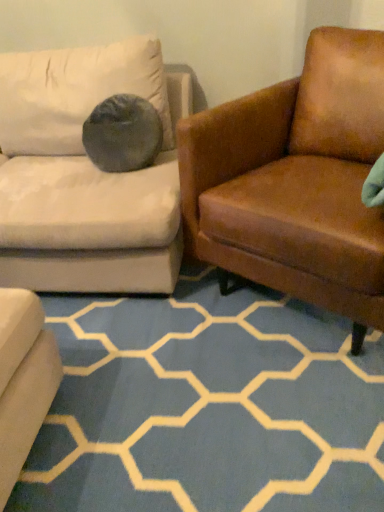
Question: Considering the relative sizes of blue carpet at center and brown leather armchair at right in the image provided, is blue carpet at center wider than brown leather armchair at right?

Choices:
 (A) no
 (B) yes

Answer: (A)

Question: From a real-world perspective, does blue carpet at center sit lower than brown leather armchair at right?

Choices:
 (A) yes
 (B) no

Answer: (A)

Question: Considering the relative sizes of blue carpet at center and brown leather armchair at right in the image provided, is blue carpet at center shorter than brown leather armchair at right?

Choices:
 (A) yes
 (B) no

Answer: (A)

Question: Is there a large distance between blue carpet at center and brown leather armchair at right?

Choices:
 (A) yes
 (B) no

Answer: (B)

Question: Does blue carpet at center turn towards brown leather armchair at right?

Choices:
 (A) no
 (B) yes

Answer: (A)

Question: Can you confirm if blue carpet at center is taller than brown leather armchair at right?

Choices:
 (A) no
 (B) yes

Answer: (A)

Question: Does brown leather armchair at right have a lesser height compared to blue carpet at center?

Choices:
 (A) yes
 (B) no

Answer: (B)

Question: Is brown leather armchair at right to the right of blue carpet at center from the viewer's perspective?

Choices:
 (A) yes
 (B) no

Answer: (A)

Question: Considering the relative positions of brown leather armchair at right and blue carpet at center in the image provided, is brown leather armchair at right to the left of blue carpet at center from the viewer's perspective?

Choices:
 (A) no
 (B) yes

Answer: (A)

Question: Could you tell me if brown leather armchair at right is facing blue carpet at center?

Choices:
 (A) yes
 (B) no

Answer: (A)

Question: Is brown leather armchair at right looking in the opposite direction of blue carpet at center?

Choices:
 (A) yes
 (B) no

Answer: (B)

Question: Is brown leather armchair at right located outside blue carpet at center?

Choices:
 (A) no
 (B) yes

Answer: (B)

Question: Is blue carpet at center bigger or smaller than brown leather armchair at right?

Choices:
 (A) big
 (B) small

Answer: (B)